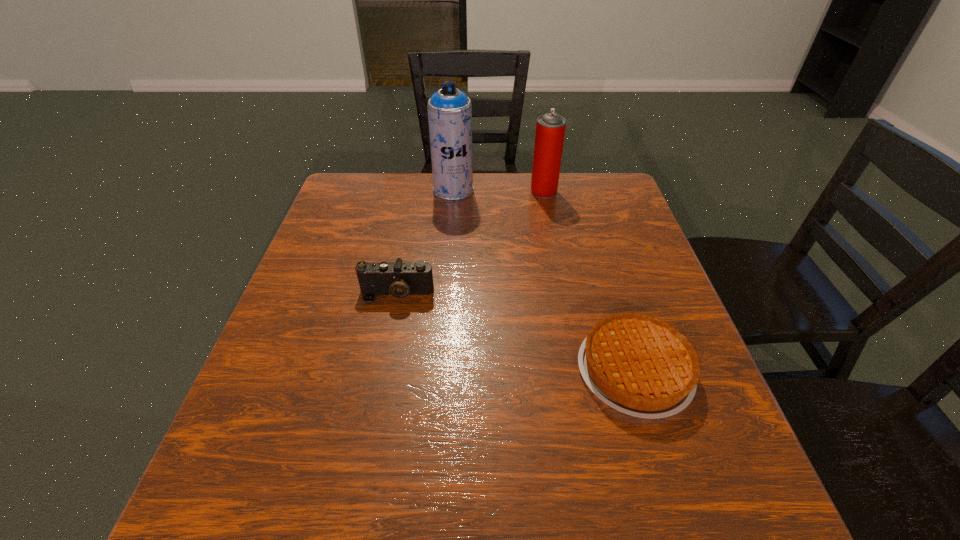
Where is `blank area located 0.370m on the front-facing side of the third farthest object`? This screenshot has width=960, height=540. blank area located 0.370m on the front-facing side of the third farthest object is located at coordinates (361, 476).

This screenshot has height=540, width=960. Find the location of `vacant space situated 0.060m on the back of the nearest object`. vacant space situated 0.060m on the back of the nearest object is located at coordinates (615, 306).

Find the location of a particular element. object located in the left edge section of the desktop is located at coordinates (398, 279).

The width and height of the screenshot is (960, 540). Identify the location of object that is positioned at the right edge. (639, 365).

In the image, there is a desktop. What are the coordinates of `vacant region at the far edge` in the screenshot? It's located at (561, 185).

You are a GUI agent. You are given a task and a screenshot of the screen. Output one action in this format:
    pyautogui.click(x=<x>, y=<y>)
    Task: Click on the vacant space at the left edge
    The image size is (960, 540).
    Given the screenshot: What is the action you would take?
    pyautogui.click(x=349, y=264)

At what (x,y) coordinates should I click in order to perform the action: click on vacant region at the right edge of the desktop. Please return your answer as a coordinate pair (x, y). This screenshot has width=960, height=540. Looking at the image, I should click on (599, 237).

In the image, there is a desktop. Where is `vacant area at the far left corner`? This screenshot has width=960, height=540. vacant area at the far left corner is located at coordinates (346, 182).

Image resolution: width=960 pixels, height=540 pixels. I want to click on vacant position at the far right corner of the desktop, so click(592, 197).

Where is `empty space between the right aerosol can and the left aerosol can`? empty space between the right aerosol can and the left aerosol can is located at coordinates (498, 191).